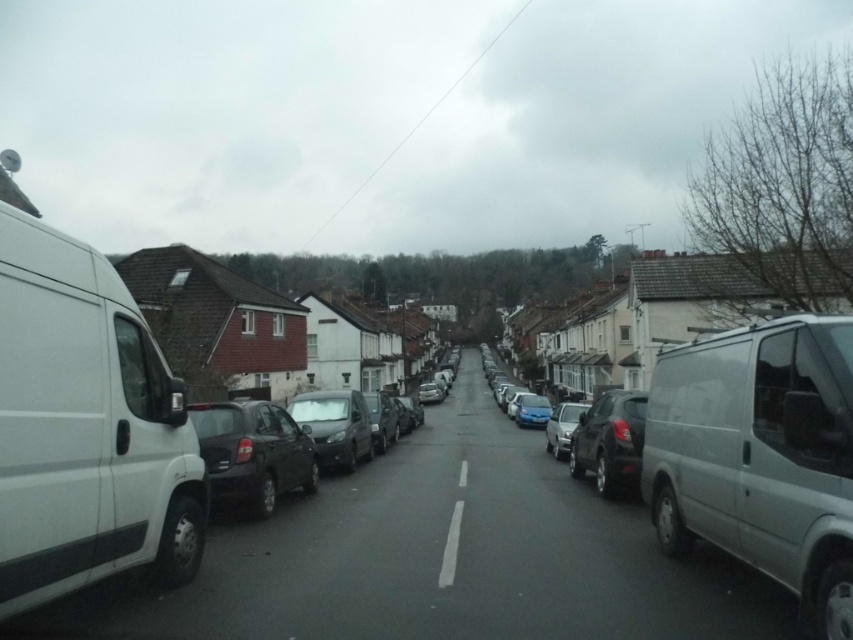
Can you confirm if white matte van at left is taller than blue metallic license plate at center?

Yes.

Where is `white matte van at left`? white matte van at left is located at coordinates (85, 428).

Between white matte van at right and blue metallic license plate at center, which one is positioned lower?

blue metallic license plate at center is below.

Can you confirm if white matte van at right is bigger than blue metallic license plate at center?

Indeed, white matte van at right has a larger size compared to blue metallic license plate at center.

The image size is (853, 640). What do you see at coordinates (759, 456) in the screenshot? I see `white matte van at right` at bounding box center [759, 456].

This screenshot has height=640, width=853. I want to click on white matte van at right, so click(x=759, y=456).

Does satin black suv at right have a lesser width compared to blue metallic license plate at center?

No.

Which is below, satin black suv at right or blue metallic license plate at center?

Positioned lower is blue metallic license plate at center.

Who is more distant from viewer, [608,472] or [538,416]?

Positioned behind is point [538,416].

You are a GUI agent. You are given a task and a screenshot of the screen. Output one action in this format:
    pyautogui.click(x=<x>, y=<y>)
    Task: Click on the satin black suv at right
    This screenshot has width=853, height=640.
    Given the screenshot: What is the action you would take?
    pyautogui.click(x=608, y=440)